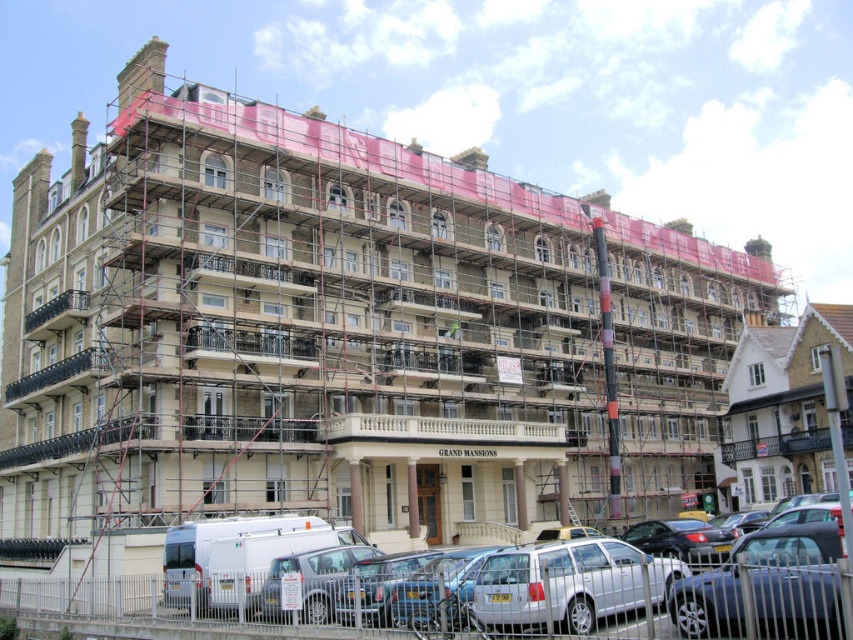
Identify the location of white wooden house at right. (784, 408).

Between white wooden house at right and metallic silver car at lower right, which one appears on the left side from the viewer's perspective?

metallic silver car at lower right is more to the left.

What do you see at coordinates (784, 408) in the screenshot? I see `white wooden house at right` at bounding box center [784, 408].

Find the location of a particular element. white wooden house at right is located at coordinates (784, 408).

Between white wooden house at right and silver metallic car at lower center, which one appears on the left side from the viewer's perspective?

Positioned to the left is silver metallic car at lower center.

Is white wooden house at right closer to camera compared to silver metallic car at lower center?

Yes, white wooden house at right is in front of silver metallic car at lower center.

Which is in front, point (772, 499) or point (572, 579)?

Point (572, 579) is in front.

Locate an element on the screen. white wooden house at right is located at coordinates (784, 408).

Does white matte van at lower left have a larger size compared to metallic silver car at lower right?

Yes, white matte van at lower left is bigger than metallic silver car at lower right.

Does white matte van at lower left appear over metallic silver car at lower right?

No, white matte van at lower left is not above metallic silver car at lower right.

Is point (647, 624) more distant than point (740, 544)?

No, (647, 624) is closer to viewer.

Find the location of `white matte van at lower left`. white matte van at lower left is located at coordinates (761, 588).